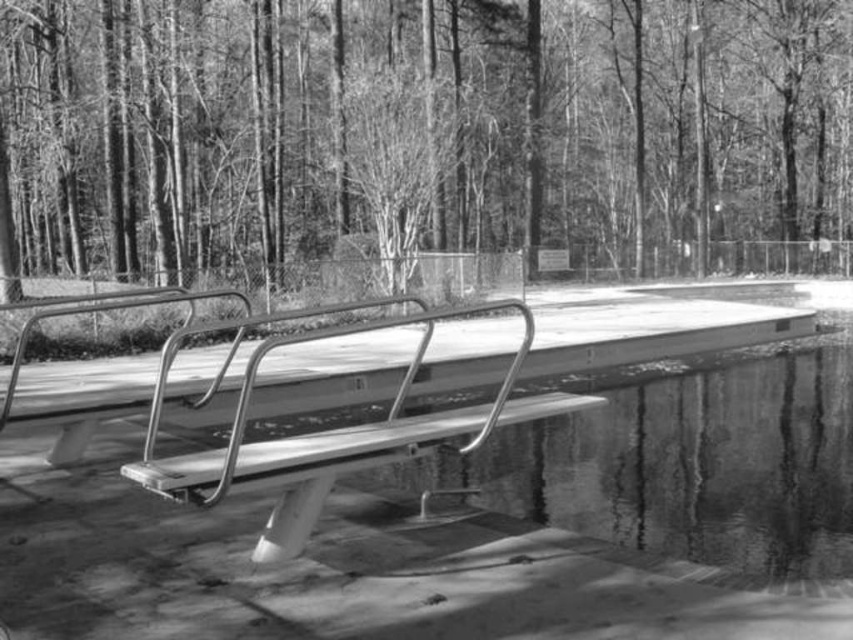
Question: Can you confirm if smooth bark tree at center is positioned above metallic silver bench at center?

Choices:
 (A) no
 (B) yes

Answer: (B)

Question: Which object appears closest to the camera in this image?

Choices:
 (A) smooth bark tree at center
 (B) metallic silver bench at center

Answer: (B)

Question: Among these objects, which one is farthest from the camera?

Choices:
 (A) metallic silver bench at center
 (B) smooth bark tree at center

Answer: (B)

Question: Is smooth bark tree at center below metallic silver bench at center?

Choices:
 (A) yes
 (B) no

Answer: (B)

Question: Does smooth bark tree at center have a smaller size compared to metallic silver bench at center?

Choices:
 (A) no
 (B) yes

Answer: (A)